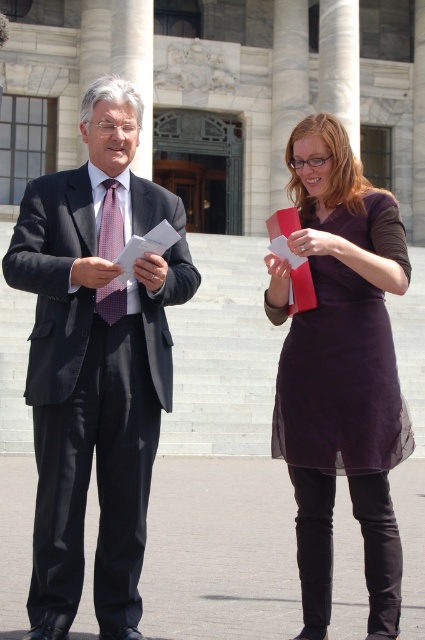
Does matte purple dress at center have a lesser width compared to checkered fabric tie at center?

Incorrect, matte purple dress at center's width is not less than checkered fabric tie at center's.

Which is behind, point (363, 481) or point (102, 257)?

The point (102, 257) is more distant.

Where is `matte purple dress at center`? matte purple dress at center is located at coordinates (342, 372).

Does matte black suit at left lie behind matte purple dress at center?

Yes, matte black suit at left is further from the viewer.

Between matte black suit at left and matte purple dress at center, which one is positioned higher?

matte black suit at left is above.

Who is more forward, (54, 344) or (297, 365)?

Point (54, 344) is more forward.

Image resolution: width=425 pixels, height=640 pixels. In order to click on matte black suit at left in this screenshot , I will do `click(95, 365)`.

Can you confirm if matte black suit at left is wider than checkered fabric tie at center?

Indeed, matte black suit at left has a greater width compared to checkered fabric tie at center.

Does point (79, 300) come in front of point (116, 285)?

Yes, it is in front of point (116, 285).

Where is `matte black suit at left`? This screenshot has width=425, height=640. matte black suit at left is located at coordinates [95, 365].